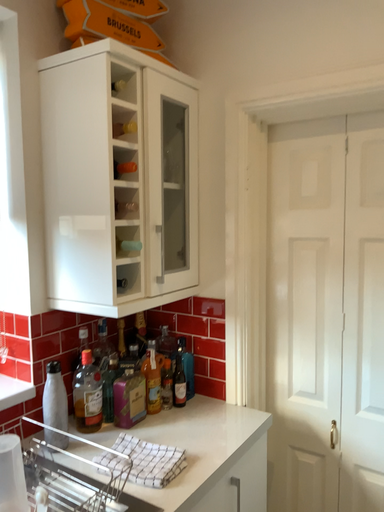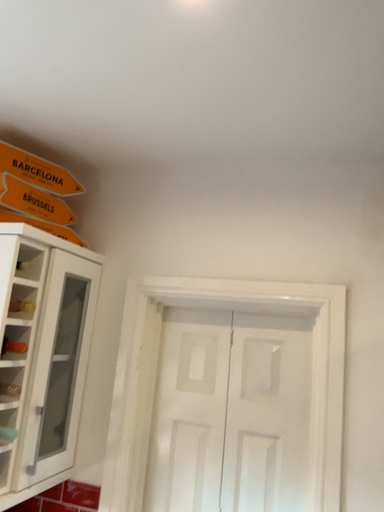
Question: How did the camera likely rotate when shooting the video?

Choices:
 (A) rotated left
 (B) rotated right

Answer: (B)